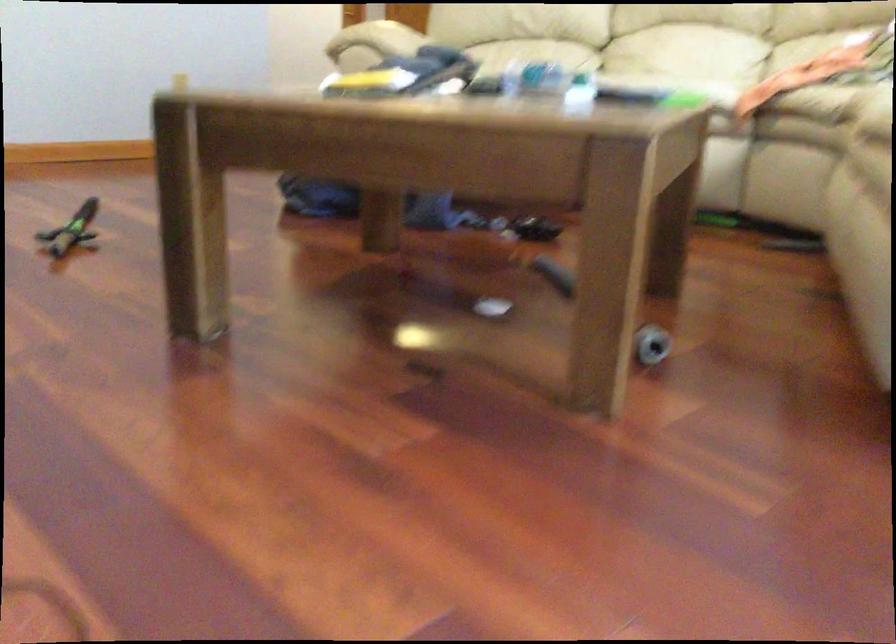
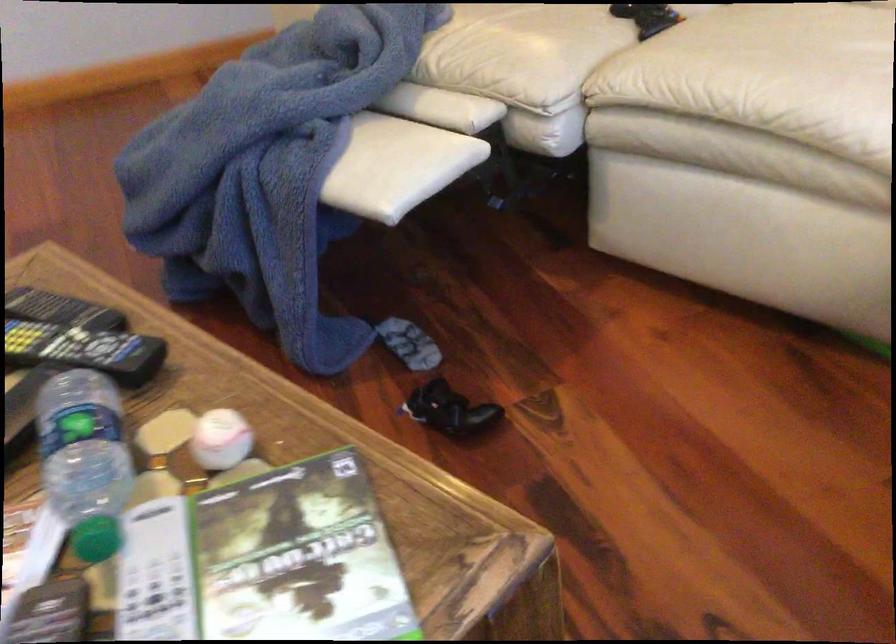
The images are taken continuously from a first-person perspective. In which direction are you moving?

The cameraman moved toward right, forward.